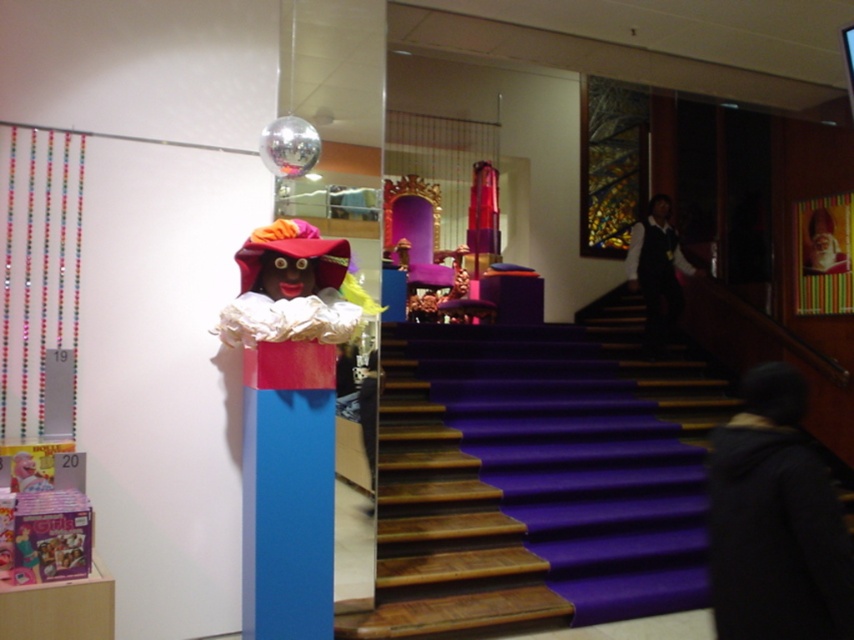
You are standing at the bottom of the purple carpeted staircase and want to place a new decorative item exactly at the center of the blue matte column at center. According to the image, what are the coordinates where you should place it?

The coordinates for the blue matte column at center are at point (287, 490), so you should place the decorative item there.

You are a visitor in this festive space and want to take a photo of the smooth plastic santa at upper right without the blue matte column at center blocking the view. Which direction should you move to ensure the column is out of frame?

Move to the right side of the blue matte column at center so that the smooth plastic santa at upper right is visible without obstruction from the column.

You are standing in the festive indoor space and want to take a photo of both the point at coordinates point (x=249, y=417) and the point at coordinates point (x=823, y=266). Which point will appear larger in your camera view?

Point (x=249, y=417) is closer to the camera than point (x=823, y=266), so it will appear larger in the camera view.